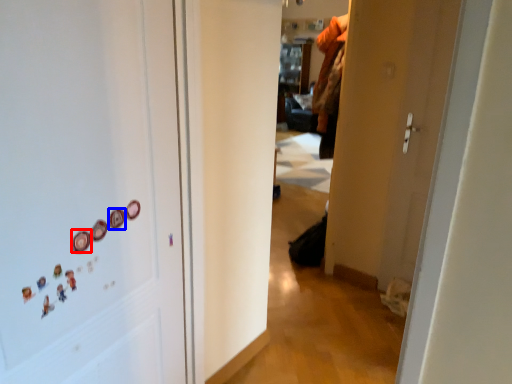
Question: Which point is further to the camera, button (highlighted by a red box) or button (highlighted by a blue box)?

Choices:
 (A) button
 (B) button

Answer: (B)